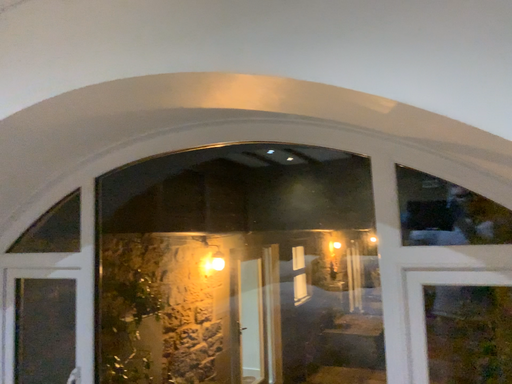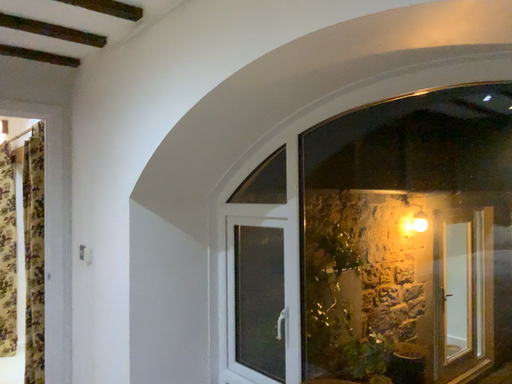
Question: How did the camera likely rotate when shooting the video?

Choices:
 (A) rotated left
 (B) rotated right

Answer: (A)